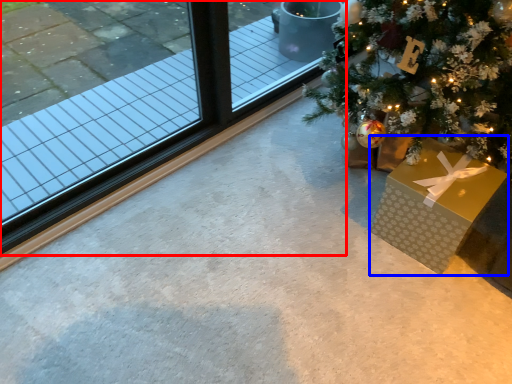
Question: Which object is further to the camera taking this photo, window (highlighted by a red box) or gift box (highlighted by a blue box)?

Choices:
 (A) window
 (B) gift box

Answer: (B)